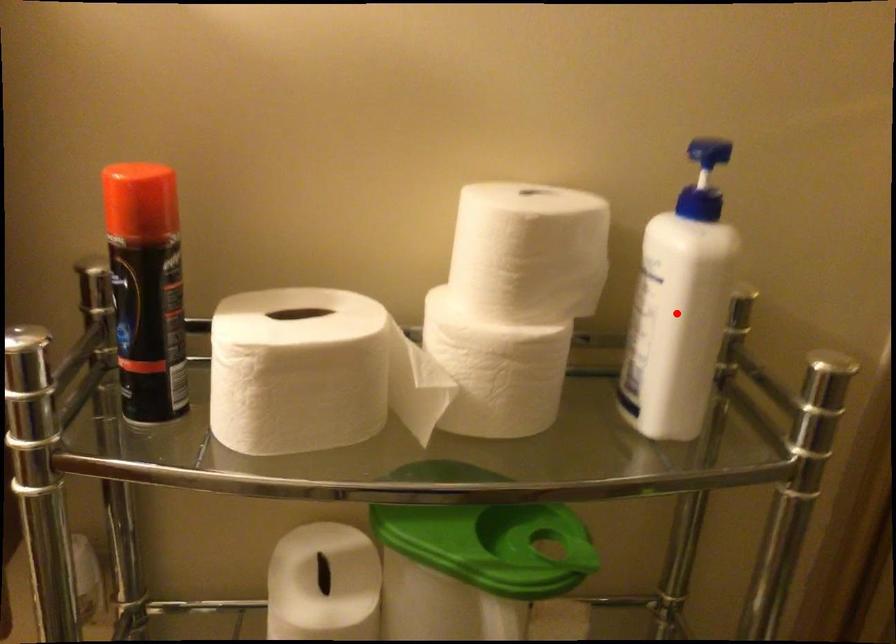
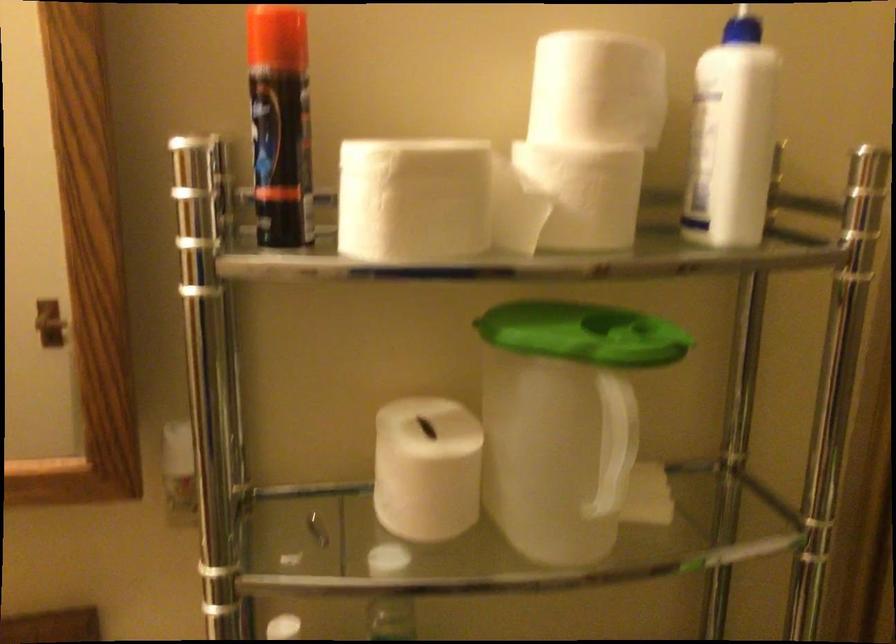
Question: I am providing you with two images of the same scene from different viewpoints. Given a red point in image1, look at the same physical point in image2. Is it:

Choices:
 (A) Closer to the viewpoint
 (B) Farther from the viewpoint

Answer: (B)